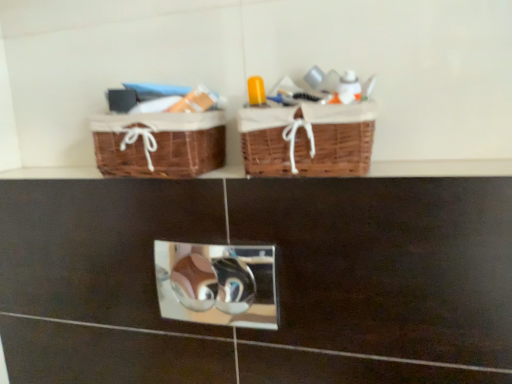
Find the location of `metallic reflective mirror at center`. metallic reflective mirror at center is located at coordinates (217, 284).

What do you see at coordinates (307, 139) in the screenshot? The height and width of the screenshot is (384, 512). I see `woven brown picnic basket at upper center, which is the 2th picnic basket from left to right` at bounding box center [307, 139].

What do you see at coordinates (441, 168) in the screenshot? This screenshot has width=512, height=384. I see `brown wicker baskets at upper center` at bounding box center [441, 168].

At what (x,y) coordinates should I click in order to perform the action: click on brown woven picnic basket at left, which is the 2th picnic basket in right-to-left order. Please return your answer as a coordinate pair (x, y). The height and width of the screenshot is (384, 512). Looking at the image, I should click on (159, 144).

Relative to metallic reflective mirror at center, is brown woven picnic basket at left, arranged as the first picnic basket when viewed from the left, in front or behind?

In the image, brown woven picnic basket at left, arranged as the first picnic basket when viewed from the left, appears behind metallic reflective mirror at center.

What's the angular difference between brown woven picnic basket at left, which is the 2th picnic basket in right-to-left order, and metallic reflective mirror at center's facing directions?

The facing directions of brown woven picnic basket at left, which is the 2th picnic basket in right-to-left order, and metallic reflective mirror at center are 0.0549 degrees apart.

How far apart are brown woven picnic basket at left, arranged as the first picnic basket when viewed from the left, and metallic reflective mirror at center?

brown woven picnic basket at left, arranged as the first picnic basket when viewed from the left, is 35.20 inches away from metallic reflective mirror at center.

Can you confirm if brown woven picnic basket at left, which is the 2th picnic basket in right-to-left order, is positioned to the left of metallic reflective mirror at center?

Yes.

Between woven brown picnic basket at upper center, which is the 2th picnic basket from left to right, and brown woven picnic basket at left, which is the 2th picnic basket in right-to-left order, which one has smaller size?

brown woven picnic basket at left, which is the 2th picnic basket in right-to-left order, is smaller.

How far apart are woven brown picnic basket at upper center, arranged as the first picnic basket when viewed from the right, and brown woven picnic basket at left, which is the 2th picnic basket in right-to-left order?

woven brown picnic basket at upper center, arranged as the first picnic basket when viewed from the right, is 17.99 centimeters away from brown woven picnic basket at left, which is the 2th picnic basket in right-to-left order.

Can you tell me how much woven brown picnic basket at upper center, which is the 2th picnic basket from left to right, and brown woven picnic basket at left, arranged as the first picnic basket when viewed from the left, differ in facing direction?

0.168 degrees.

Is woven brown picnic basket at upper center, arranged as the first picnic basket when viewed from the right, oriented away from brown woven picnic basket at left, which is the 2th picnic basket in right-to-left order?

No, woven brown picnic basket at upper center, arranged as the first picnic basket when viewed from the right, is not facing the opposite direction of brown woven picnic basket at left, which is the 2th picnic basket in right-to-left order.

From a real-world perspective, is brown wicker baskets at upper center on top of metallic reflective mirror at center?

Yes, from a real-world perspective, brown wicker baskets at upper center is on top of metallic reflective mirror at center.

Which is correct: brown wicker baskets at upper center is inside metallic reflective mirror at center, or outside of it?

brown wicker baskets at upper center lies outside metallic reflective mirror at center.

Considering the positions of point (52, 174) and point (207, 311), is point (52, 174) closer or farther from the camera than point (207, 311)?

Point (52, 174) appears to be closer to the viewer than point (207, 311).

Does metallic reflective mirror at center have a lesser width compared to woven brown picnic basket at upper center, which is the 2th picnic basket from left to right?

Indeed, metallic reflective mirror at center has a lesser width compared to woven brown picnic basket at upper center, which is the 2th picnic basket from left to right.

From a real-world perspective, which object stands above the other?

In real-world perspective, woven brown picnic basket at upper center, which is the 2th picnic basket from left to right, is above.

Does metallic reflective mirror at center appear on the left side of woven brown picnic basket at upper center, which is the 2th picnic basket from left to right?

Indeed, metallic reflective mirror at center is positioned on the left side of woven brown picnic basket at upper center, which is the 2th picnic basket from left to right.

Which object is further away from the camera, metallic reflective mirror at center or woven brown picnic basket at upper center, which is the 2th picnic basket from left to right?

metallic reflective mirror at center is behind.

Considering the sizes of woven brown picnic basket at upper center, which is the 2th picnic basket from left to right, and brown wicker baskets at upper center in the image, is woven brown picnic basket at upper center, which is the 2th picnic basket from left to right, wider or thinner than brown wicker baskets at upper center?

Clearly, woven brown picnic basket at upper center, which is the 2th picnic basket from left to right, has more width compared to brown wicker baskets at upper center.

Considering the sizes of woven brown picnic basket at upper center, arranged as the first picnic basket when viewed from the right, and brown wicker baskets at upper center in the image, is woven brown picnic basket at upper center, arranged as the first picnic basket when viewed from the right, bigger or smaller than brown wicker baskets at upper center?

Considering their sizes, woven brown picnic basket at upper center, arranged as the first picnic basket when viewed from the right, takes up more space than brown wicker baskets at upper center.

Who is more distant, woven brown picnic basket at upper center, which is the 2th picnic basket from left to right, or brown wicker baskets at upper center?

woven brown picnic basket at upper center, which is the 2th picnic basket from left to right, is more distant.

From the image's perspective, which one is positioned lower, brown woven picnic basket at left, which is the 2th picnic basket in right-to-left order, or woven brown picnic basket at upper center, which is the 2th picnic basket from left to right?

brown woven picnic basket at left, which is the 2th picnic basket in right-to-left order, is shown below in the image.

In the image, is brown woven picnic basket at left, which is the 2th picnic basket in right-to-left order, positioned in front of or behind woven brown picnic basket at upper center, arranged as the first picnic basket when viewed from the right?

brown woven picnic basket at left, which is the 2th picnic basket in right-to-left order, is positioned farther from the viewer than woven brown picnic basket at upper center, arranged as the first picnic basket when viewed from the right.

Can you tell me how much brown woven picnic basket at left, arranged as the first picnic basket when viewed from the left, and woven brown picnic basket at upper center, arranged as the first picnic basket when viewed from the right, differ in facing direction?

There is a 0.168-degree angle between the facing directions of brown woven picnic basket at left, arranged as the first picnic basket when viewed from the left, and woven brown picnic basket at upper center, arranged as the first picnic basket when viewed from the right.

Which of these two, brown woven picnic basket at left, arranged as the first picnic basket when viewed from the left, or woven brown picnic basket at upper center, which is the 2th picnic basket from left to right, is bigger?

Bigger between the two is woven brown picnic basket at upper center, which is the 2th picnic basket from left to right.

Is brown woven picnic basket at left, arranged as the first picnic basket when viewed from the left, aimed at brown wicker baskets at upper center?

No.

Which of these two, brown woven picnic basket at left, arranged as the first picnic basket when viewed from the left, or brown wicker baskets at upper center, is wider?

With larger width is brown woven picnic basket at left, arranged as the first picnic basket when viewed from the left.

Would you say brown woven picnic basket at left, which is the 2th picnic basket in right-to-left order, contains brown wicker baskets at upper center?

Actually, brown wicker baskets at upper center is outside brown woven picnic basket at left, which is the 2th picnic basket in right-to-left order.

Considering the sizes of objects brown woven picnic basket at left, arranged as the first picnic basket when viewed from the left, and brown wicker baskets at upper center in the image provided, who is bigger, brown woven picnic basket at left, arranged as the first picnic basket when viewed from the left, or brown wicker baskets at upper center?

brown woven picnic basket at left, arranged as the first picnic basket when viewed from the left, is bigger.

The image size is (512, 384). I want to click on picnic basket located on the left of metallic reflective mirror at center, so click(159, 144).

Where is `picnic basket below the woven brown picnic basket at upper center, which is the 2th picnic basket from left to right (from a real-world perspective)`? Image resolution: width=512 pixels, height=384 pixels. picnic basket below the woven brown picnic basket at upper center, which is the 2th picnic basket from left to right (from a real-world perspective) is located at coordinates (159, 144).

Looking at the image, which one is located further to brown wicker baskets at upper center, metallic reflective mirror at center or brown woven picnic basket at left, which is the 2th picnic basket in right-to-left order?

metallic reflective mirror at center.

Which object lies further to the anchor point brown woven picnic basket at left, which is the 2th picnic basket in right-to-left order, brown wicker baskets at upper center or woven brown picnic basket at upper center, arranged as the first picnic basket when viewed from the right?

brown wicker baskets at upper center.

Looking at the image, which one is located further to brown wicker baskets at upper center, woven brown picnic basket at upper center, arranged as the first picnic basket when viewed from the right, or brown woven picnic basket at left, which is the 2th picnic basket in right-to-left order?

Based on the image, brown woven picnic basket at left, which is the 2th picnic basket in right-to-left order, appears to be further to brown wicker baskets at upper center.

Considering their positions, is brown woven picnic basket at left, arranged as the first picnic basket when viewed from the left, positioned closer to metallic reflective mirror at center than brown wicker baskets at upper center?

brown woven picnic basket at left, arranged as the first picnic basket when viewed from the left, is positioned closer to the anchor metallic reflective mirror at center.

Looking at the image, which one is located closer to metallic reflective mirror at center, woven brown picnic basket at upper center, which is the 2th picnic basket from left to right, or brown woven picnic basket at left, arranged as the first picnic basket when viewed from the left?

brown woven picnic basket at left, arranged as the first picnic basket when viewed from the left, lies closer to metallic reflective mirror at center than the other object.

Estimate the real-world distances between objects in this image. Which object is further from woven brown picnic basket at upper center, which is the 2th picnic basket from left to right, brown wicker baskets at upper center or metallic reflective mirror at center?

The object further to woven brown picnic basket at upper center, which is the 2th picnic basket from left to right, is metallic reflective mirror at center.

Which object lies further to the anchor point brown woven picnic basket at left, which is the 2th picnic basket in right-to-left order, woven brown picnic basket at upper center, arranged as the first picnic basket when viewed from the right, or brown wicker baskets at upper center?

brown wicker baskets at upper center is further to brown woven picnic basket at left, which is the 2th picnic basket in right-to-left order.

Based on the photo, based on their spatial positions, is brown woven picnic basket at left, arranged as the first picnic basket when viewed from the left, or woven brown picnic basket at upper center, which is the 2th picnic basket from left to right, further from brown wicker baskets at upper center?

brown woven picnic basket at left, arranged as the first picnic basket when viewed from the left, is positioned further to the anchor brown wicker baskets at upper center.

This screenshot has height=384, width=512. I want to click on picnic basket between woven brown picnic basket at upper center, arranged as the first picnic basket when viewed from the right, and metallic reflective mirror at center vertically, so click(x=159, y=144).

I want to click on ledge situated between brown woven picnic basket at left, which is the 2th picnic basket in right-to-left order, and woven brown picnic basket at upper center, which is the 2th picnic basket from left to right, from left to right, so click(441, 168).

Identify the location of ledge that lies between woven brown picnic basket at upper center, arranged as the first picnic basket when viewed from the right, and metallic reflective mirror at center from top to bottom. (441, 168).

I want to click on ledge between brown woven picnic basket at left, arranged as the first picnic basket when viewed from the left, and metallic reflective mirror at center from top to bottom, so click(441, 168).